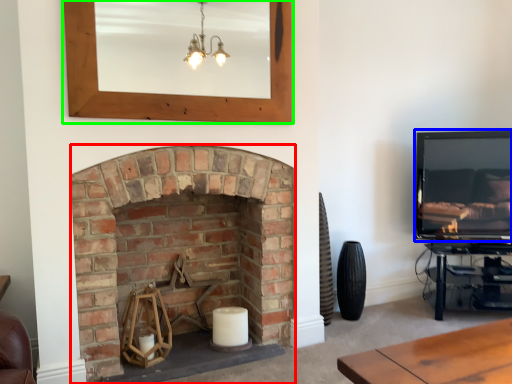
Question: Estimate the real-world distances between objects in this image. Which object is closer to fireplace (highlighted by a red box), television (highlighted by a blue box) or picture frame (highlighted by a green box)?

Choices:
 (A) television
 (B) picture frame

Answer: (B)